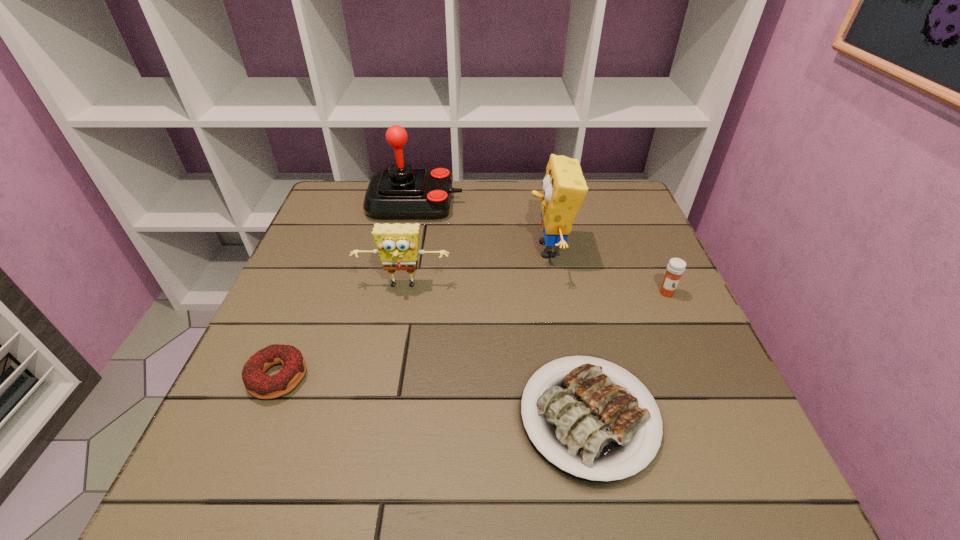
The image size is (960, 540). In order to click on joystick in this screenshot , I will do `click(402, 192)`.

At what (x,y) coordinates should I click in order to perform the action: click on the right sponge. Please return your answer as a coordinate pair (x, y). Looking at the image, I should click on (564, 188).

You are a GUI agent. You are given a task and a screenshot of the screen. Output one action in this format:
    pyautogui.click(x=<x>, y=<y>)
    Task: Click on the shorter sponge
    The image size is (960, 540).
    Given the screenshot: What is the action you would take?
    pyautogui.click(x=397, y=244)

At what (x,y) coordinates should I click in order to perform the action: click on the left sponge. Please return your answer as a coordinate pair (x, y). The width and height of the screenshot is (960, 540). Looking at the image, I should click on (397, 244).

Locate an element on the screen. This screenshot has height=540, width=960. medicine is located at coordinates (676, 267).

Where is `the fourth tallest object`? This screenshot has height=540, width=960. the fourth tallest object is located at coordinates (676, 267).

The width and height of the screenshot is (960, 540). What are the coordinates of `doughnut` in the screenshot? It's located at (259, 384).

At what (x,y) coordinates should I click in order to perform the action: click on the second shortest object. Please return your answer as a coordinate pair (x, y). The height and width of the screenshot is (540, 960). Looking at the image, I should click on (259, 384).

You are a GUI agent. You are given a task and a screenshot of the screen. Output one action in this format:
    pyautogui.click(x=<x>, y=<y>)
    Task: Click on the shortest object
    The width and height of the screenshot is (960, 540).
    Given the screenshot: What is the action you would take?
    pyautogui.click(x=596, y=427)

Locate an element on the screen. The height and width of the screenshot is (540, 960). vacant space located 0.150m on the base of the joystick is located at coordinates (516, 203).